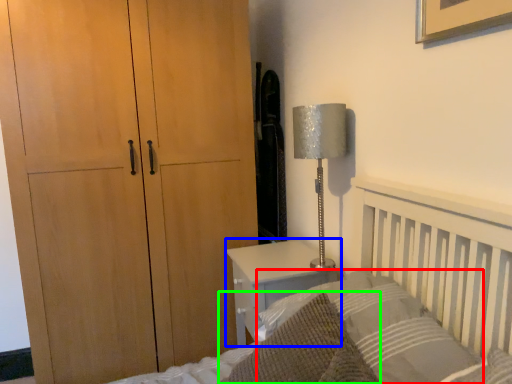
Question: Which object is the closest to the pillow (highlighted by a red box)? Choose among these: nightstand (highlighted by a blue box) or throw pillow (highlighted by a green box).

Choices:
 (A) nightstand
 (B) throw pillow

Answer: (B)